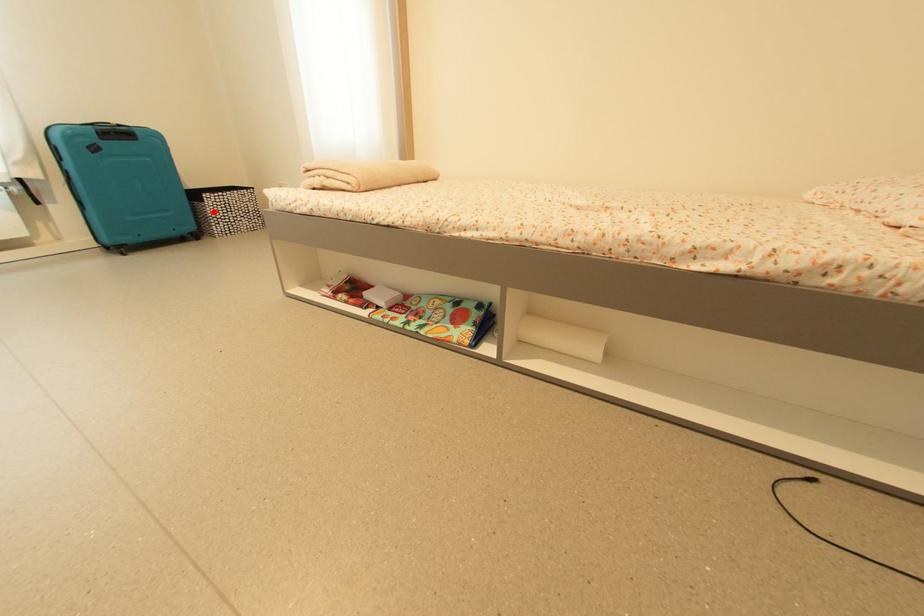
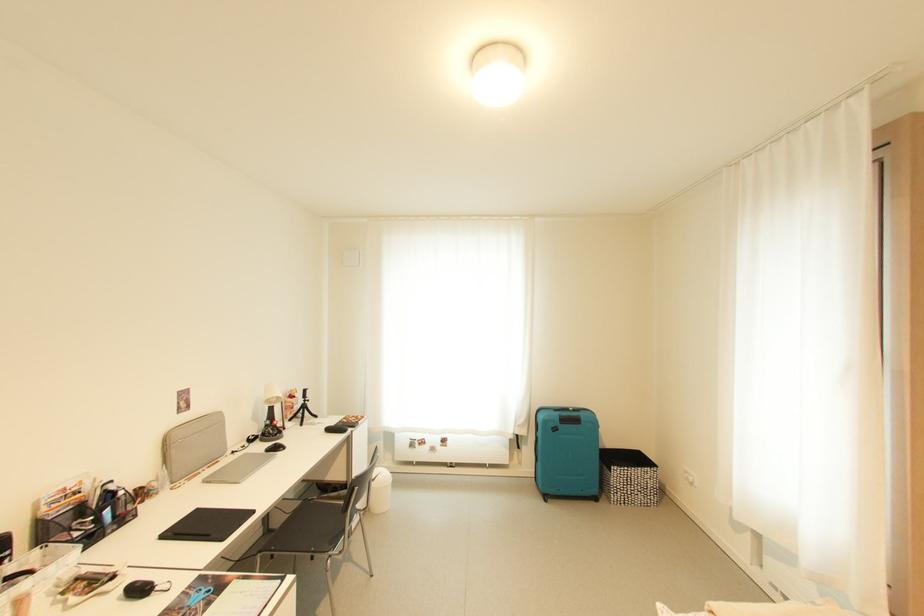
Find the pixel in the second image that matches the highlighted location in the first image.

(617, 482)